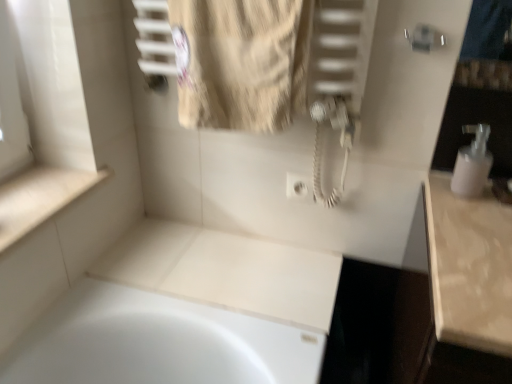
This screenshot has height=384, width=512. What do you see at coordinates (241, 62) in the screenshot? I see `beige textured towel at upper center` at bounding box center [241, 62].

Describe the element at coordinates (472, 163) in the screenshot. This screenshot has height=384, width=512. I see `white plastic soap dispenser at right` at that location.

Where is `beige textured towel at upper center`? The width and height of the screenshot is (512, 384). beige textured towel at upper center is located at coordinates (241, 62).

Would you consider white glossy counter top at lower left to be distant from white plastic soap dispenser at right?

That's not correct — white glossy counter top at lower left is a little close to white plastic soap dispenser at right.

Is white glossy counter top at lower left at the right side of white plastic soap dispenser at right?

Incorrect, white glossy counter top at lower left is not on the right side of white plastic soap dispenser at right.

Can you confirm if white glossy counter top at lower left is smaller than white plastic soap dispenser at right?

Actually, white glossy counter top at lower left might be larger than white plastic soap dispenser at right.

Considering the positions of objects white glossy counter top at lower left and white plastic soap dispenser at right in the image provided, who is in front, white glossy counter top at lower left or white plastic soap dispenser at right?

Positioned in front is white glossy counter top at lower left.

From the image's perspective, is white glossy counter top at lower left located above beige textured towel at upper center?

No, from the image's perspective, white glossy counter top at lower left is not on top of beige textured towel at upper center.

This screenshot has height=384, width=512. In order to click on bath towel on the right side of white glossy counter top at lower left in this screenshot , I will do `click(241, 62)`.

Can you tell me how much white glossy counter top at lower left and beige textured towel at upper center differ in facing direction?

There is a 92.1-degree angle between the facing directions of white glossy counter top at lower left and beige textured towel at upper center.

Who is taller, white plastic soap dispenser at right or beige textured towel at upper center?

beige textured towel at upper center.

Considering the relative positions of white plastic soap dispenser at right and beige textured towel at upper center in the image provided, is white plastic soap dispenser at right to the left of beige textured towel at upper center from the viewer's perspective?

In fact, white plastic soap dispenser at right is to the right of beige textured towel at upper center.

In the scene shown: Is white plastic soap dispenser at right facing towards beige textured towel at upper center?

No, white plastic soap dispenser at right is not aimed at beige textured towel at upper center.

Is white plastic soap dispenser at right inside the boundaries of beige textured towel at upper center, or outside?

white plastic soap dispenser at right exists outside the volume of beige textured towel at upper center.

Is beige textured towel at upper center inside the boundaries of white plastic soap dispenser at right, or outside?

beige textured towel at upper center is outside white plastic soap dispenser at right.

Considering the relative sizes of beige textured towel at upper center and white plastic soap dispenser at right in the image provided, is beige textured towel at upper center bigger than white plastic soap dispenser at right?

Indeed, beige textured towel at upper center has a larger size compared to white plastic soap dispenser at right.

From the image's perspective, between beige textured towel at upper center and white plastic soap dispenser at right, who is located below?

white plastic soap dispenser at right.

In the scene shown: Considering the sizes of beige textured towel at upper center and white glossy counter top at lower left in the image, is beige textured towel at upper center bigger or smaller than white glossy counter top at lower left?

In the image, beige textured towel at upper center appears to be larger than white glossy counter top at lower left.

Can you confirm if beige textured towel at upper center is positioned to the left of white glossy counter top at lower left?

No.

Based on the photo, is beige textured towel at upper center taller or shorter than white glossy counter top at lower left?

Considering their sizes, beige textured towel at upper center has more height than white glossy counter top at lower left.

Which object is closer to the camera taking this photo, beige textured towel at upper center or white glossy counter top at lower left?

beige textured towel at upper center is more forward.

Are white plastic soap dispenser at right and white glossy counter top at lower left making contact?

No.

Considering the sizes of white plastic soap dispenser at right and white glossy counter top at lower left in the image, is white plastic soap dispenser at right bigger or smaller than white glossy counter top at lower left?

white plastic soap dispenser at right is smaller than white glossy counter top at lower left.

Is the depth of white plastic soap dispenser at right less than that of white glossy counter top at lower left?

No, white plastic soap dispenser at right is further to the viewer.

Could you measure the distance between white plastic soap dispenser at right and white glossy counter top at lower left?

white plastic soap dispenser at right and white glossy counter top at lower left are 38.58 inches apart from each other.

Identify the location of counter top below the white plastic soap dispenser at right (from a real-world perspective). The image size is (512, 384). (40, 198).

Locate an element on the screen. This screenshot has width=512, height=384. counter top behind the beige textured towel at upper center is located at coordinates (40, 198).

From the image, which object appears to be nearer to white plastic soap dispenser at right, beige textured towel at upper center or white glossy counter top at lower left?

Based on the image, beige textured towel at upper center appears to be nearer to white plastic soap dispenser at right.

Looking at the image, which one is located closer to white glossy counter top at lower left, beige textured towel at upper center or white plastic soap dispenser at right?

Based on the image, beige textured towel at upper center appears to be nearer to white glossy counter top at lower left.

In the scene shown: From the image, which object appears to be farther from beige textured towel at upper center, white plastic soap dispenser at right or white glossy counter top at lower left?

Based on the image, white plastic soap dispenser at right appears to be further to beige textured towel at upper center.

Looking at the image, which one is located further to white glossy counter top at lower left, white plastic soap dispenser at right or beige textured towel at upper center?

white plastic soap dispenser at right.

Based on the photo, considering their positions, is white glossy counter top at lower left positioned closer to beige textured towel at upper center than white plastic soap dispenser at right?

white glossy counter top at lower left is positioned closer to the anchor beige textured towel at upper center.

Considering their positions, is white glossy counter top at lower left positioned closer to white plastic soap dispenser at right than beige textured towel at upper center?

beige textured towel at upper center lies closer to white plastic soap dispenser at right than the other object.

At what (x,y) coordinates should I click in order to perform the action: click on bath towel between white glossy counter top at lower left and white plastic soap dispenser at right in the horizontal direction. Please return your answer as a coordinate pair (x, y). Image resolution: width=512 pixels, height=384 pixels. Looking at the image, I should click on (241, 62).